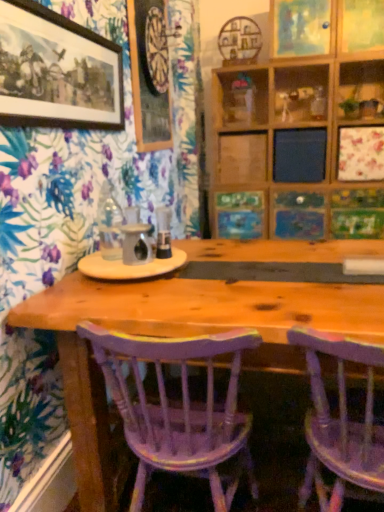
Question: Is wooden shelf at center wider or thinner than purple painted wood chair at center, placed as the 2th chair when sorted from right to left?

Choices:
 (A) thin
 (B) wide

Answer: (A)

Question: Would you say wooden shelf at center is inside or outside purple painted wood chair at center, placed as the 2th chair when sorted from right to left?

Choices:
 (A) inside
 (B) outside

Answer: (B)

Question: Which object is the farthest from the matte black picture frame at upper left, the 1th picture frame positioned from the left?

Choices:
 (A) pastel painted picture at upper center, which is the 2th decorative picture from bottom to top
 (B) wooden shelf at center
 (C) wooden painted picture frame at center, the second decorative picture from the top
 (D) purple painted wood chair at lower right, which is counted as the first chair, starting from the right
 (E) wooden picture frame at upper center, arranged as the second picture frame when viewed from the back

Answer: (B)

Question: Considering the real-world distances, which object is closest to the purple painted wood chair at center, placed as the 2th chair when sorted from right to left?

Choices:
 (A) wooden picture frame at upper center, arranged as the second picture frame when viewed from the back
 (B) pastel painted picture at upper center, the first decorative picture viewed from the top
 (C) matte black picture frame at upper left, which appears as the third picture frame when viewed from the right
 (D) wooden painted picture frame at center, the second decorative picture from the top
 (E) purple painted wood chair at lower right, which appears as the 2th chair when viewed from the left

Answer: (E)